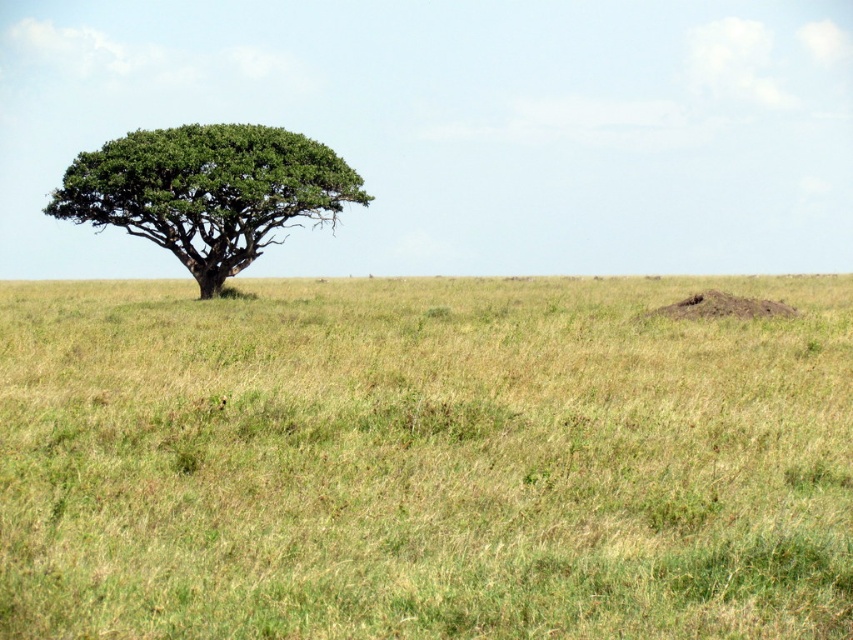
Based on the photo, does green grass at center have a greater height compared to green leafy tree at left?

No.

Which is below, green grass at center or green leafy tree at left?

Positioned lower is green grass at center.

Is point (419, 528) farther from viewer compared to point (229, 208)?

No, it is in front of (229, 208).

At what (x,y) coordinates should I click in order to perform the action: click on green grass at center. Please return your answer as a coordinate pair (x, y). Looking at the image, I should click on (422, 460).